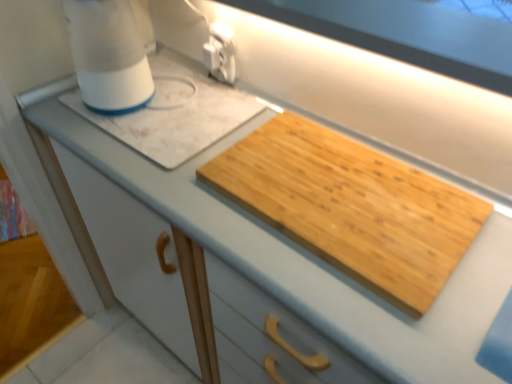
You are a GUI agent. You are given a task and a screenshot of the screen. Output one action in this format:
    pyautogui.click(x=<x>, y=<y>)
    Task: Click on the free space in front of white plastic blender at upper left
    Image resolution: width=512 pixels, height=384 pixels.
    Given the screenshot: What is the action you would take?
    point(108,146)